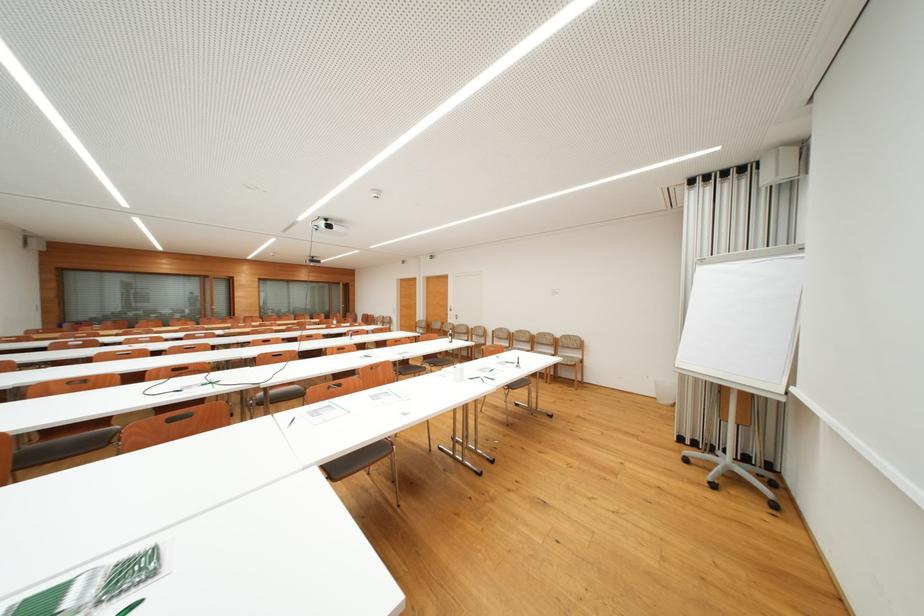
Where would you pull the wooden door handle? Please return your answer as a coordinate pair (x, y).

(445, 315)